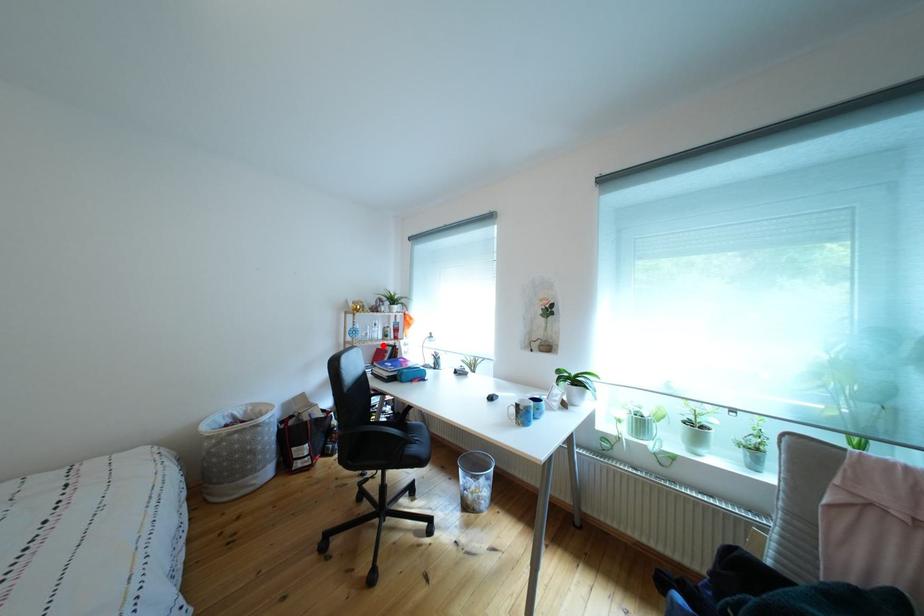
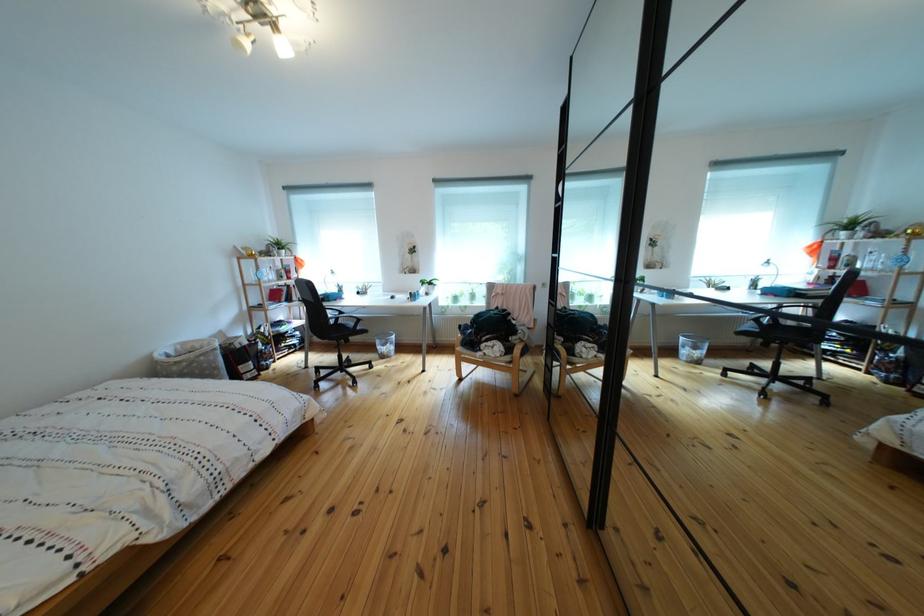
In the second image, find the point that corresponds to the highlighted location in the first image.

(282, 286)